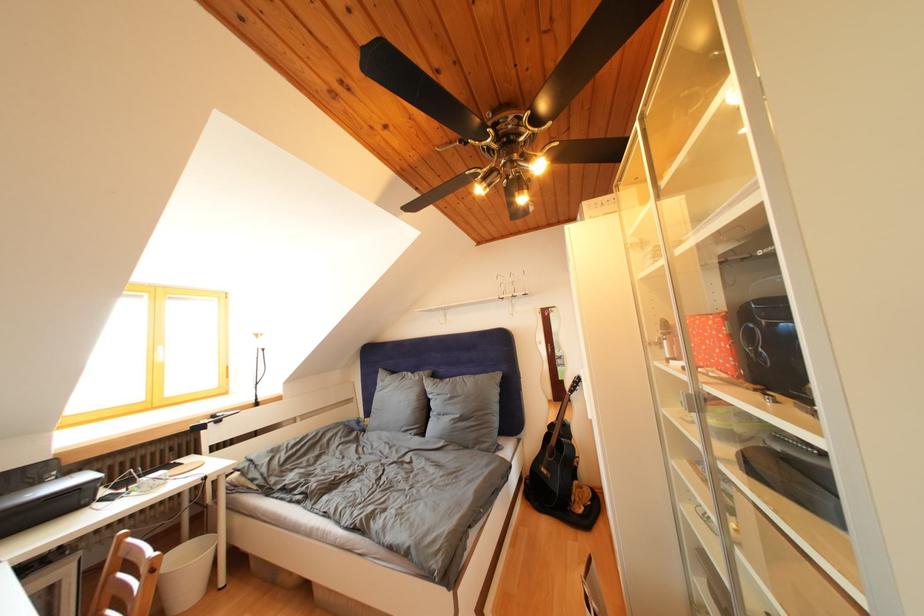
Describe the element at coordinates (716, 485) in the screenshot. The height and width of the screenshot is (616, 924). I see `the cabinet door edge` at that location.